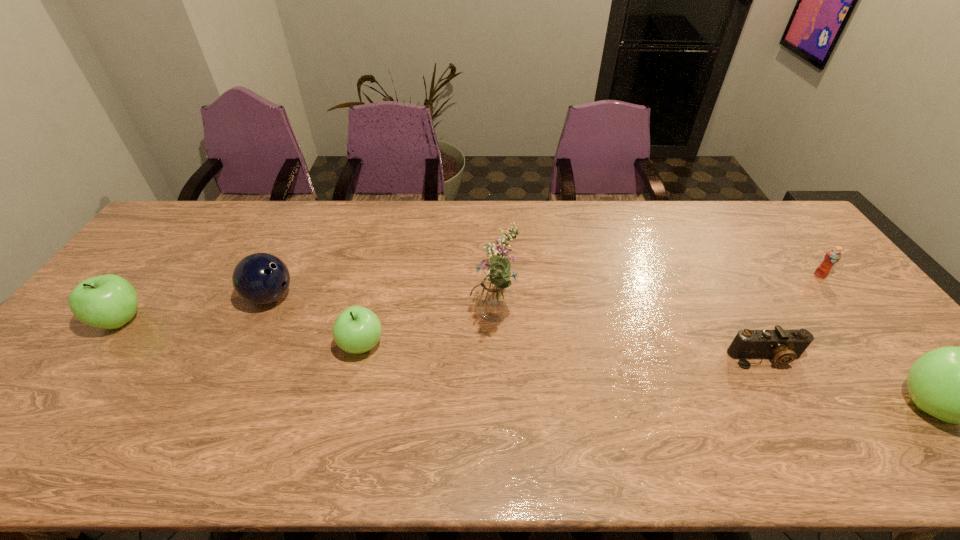
Where is `vacant space at the far edge of the desktop`? This screenshot has height=540, width=960. vacant space at the far edge of the desktop is located at coordinates (752, 233).

Identify the location of free location at the left edge of the desktop. (156, 248).

Identify the location of free space at the far left corner. The width and height of the screenshot is (960, 540). (210, 207).

Where is `blank space at the near left corner of the desktop`? blank space at the near left corner of the desktop is located at coordinates (43, 416).

Locate an element on the screen. The image size is (960, 540). free point between the leftmost apple and the second object from left to right is located at coordinates (196, 308).

I want to click on free space between the camera and the shortest apple, so click(564, 352).

This screenshot has height=540, width=960. Find the location of `unoccupied area between the second apple from right to left and the farthest object`. unoccupied area between the second apple from right to left and the farthest object is located at coordinates (590, 310).

Identify the location of vacant space that is in between the second shortest apple and the bowling ball. Image resolution: width=960 pixels, height=540 pixels. (196, 308).

Find the location of a particular element. The width and height of the screenshot is (960, 540). free space between the fourth object from right to left and the farthest object is located at coordinates (657, 299).

Where is `unoccupied position between the farthest object and the sixth object from right to left`? Image resolution: width=960 pixels, height=540 pixels. unoccupied position between the farthest object and the sixth object from right to left is located at coordinates (545, 286).